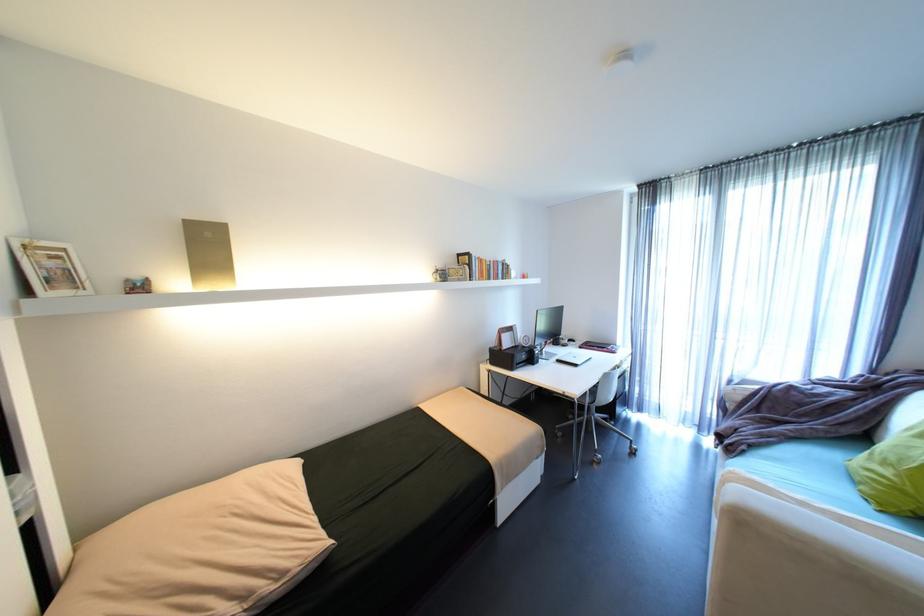
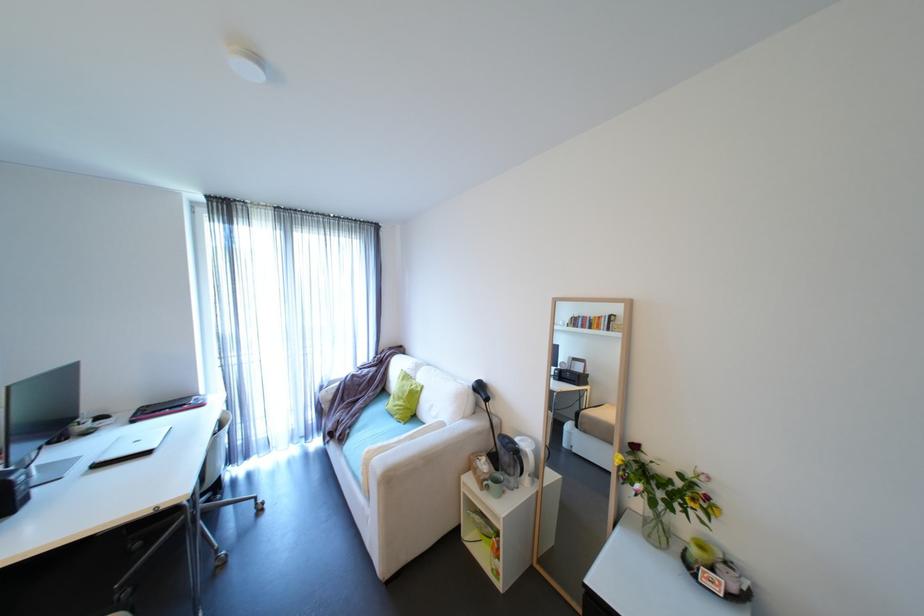
Locate, in the second image, the point that corresponds to (743,382) in the first image.

(333, 386)